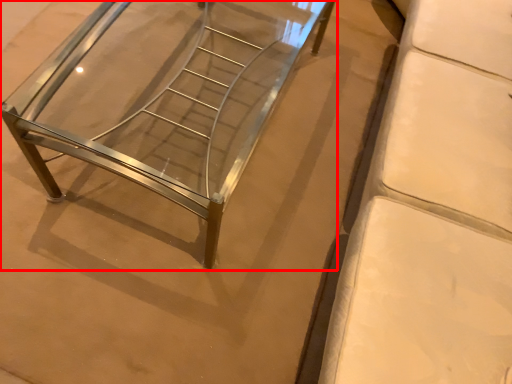
Question: From the image's perspective, where is furniture (annotated by the red box) located relative to furniture?

Choices:
 (A) above
 (B) below

Answer: (A)